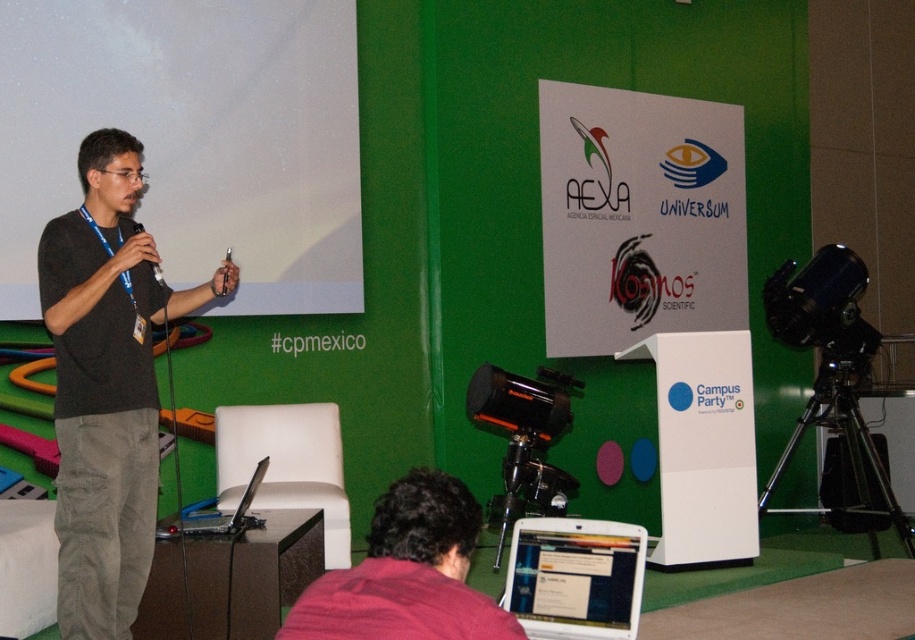
Question: Can you confirm if white matte projection screen at upper left is smaller than white glossy laptop at lower center?

Choices:
 (A) yes
 (B) no

Answer: (B)

Question: Does pink fabric at lower center appear under white glossy laptop at lower center?

Choices:
 (A) yes
 (B) no

Answer: (B)

Question: Is white matte projection screen at upper left above silver metallic laptop at lower center?

Choices:
 (A) no
 (B) yes

Answer: (B)

Question: Which is nearer to the white matte projection screen at upper left?

Choices:
 (A) dark gray sweater at left
 (B) white glossy laptop at lower center
 (C) black plastic microphone at upper left

Answer: (A)

Question: Which point is farther to the camera?

Choices:
 (A) silver metallic laptop at lower center
 (B) pink fabric at lower center
 (C) dark gray sweater at left
 (D) white glossy laptop at lower center

Answer: (A)

Question: Which object appears farthest from the camera in this image?

Choices:
 (A) white glossy laptop at lower center
 (B) silver metallic laptop at lower center
 (C) white matte projection screen at upper left
 (D) dark gray sweater at left

Answer: (C)